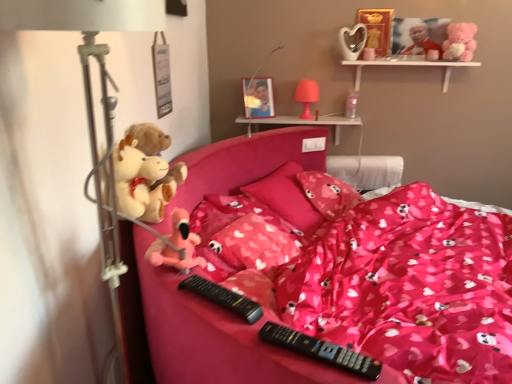
Image resolution: width=512 pixels, height=384 pixels. In order to click on free point above white wooden shelf at upper right, which appears as the second shelf when ordered from the bottom (from a real-world perspective) in this screenshot , I will do `click(404, 58)`.